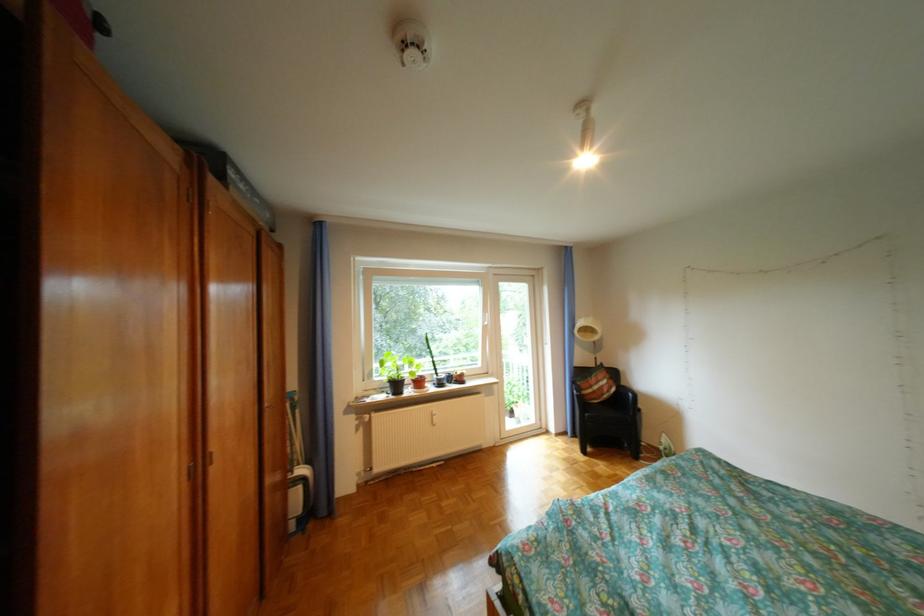
Which object does [225,198] point to?

It corresponds to the black box in the image.